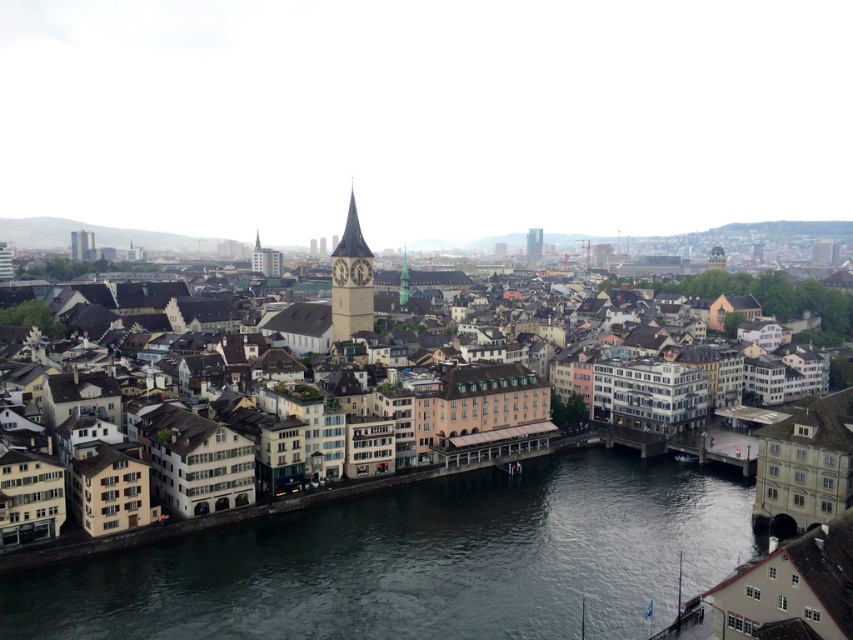
In the scene shown: Is dark gray water at center wider than glassy modern skyscraper at center?

Correct, the width of dark gray water at center exceeds that of glassy modern skyscraper at center.

Which of these two, dark gray water at center or glassy modern skyscraper at center, stands taller?

glassy modern skyscraper at center is taller.

Does point (648, 573) lie in front of point (537, 252)?

Yes, it is in front of point (537, 252).

Identify the location of dark gray water at center. (421, 561).

How much distance is there between white stone buildings at center and smooth stone tower at center?

96.35 meters

Which is below, white stone buildings at center or smooth stone tower at center?

Positioned lower is smooth stone tower at center.

Where is `white stone buildings at center`? The width and height of the screenshot is (853, 640). white stone buildings at center is located at coordinates (648, 492).

Where is `white stone buildings at center`? The image size is (853, 640). white stone buildings at center is located at coordinates (648, 492).

Where is `dark gray water at center`? dark gray water at center is located at coordinates (421, 561).

Measure the distance between dark gray water at center and camera.

dark gray water at center is 93.02 meters from camera.

This screenshot has width=853, height=640. Identify the location of dark gray water at center. (421, 561).